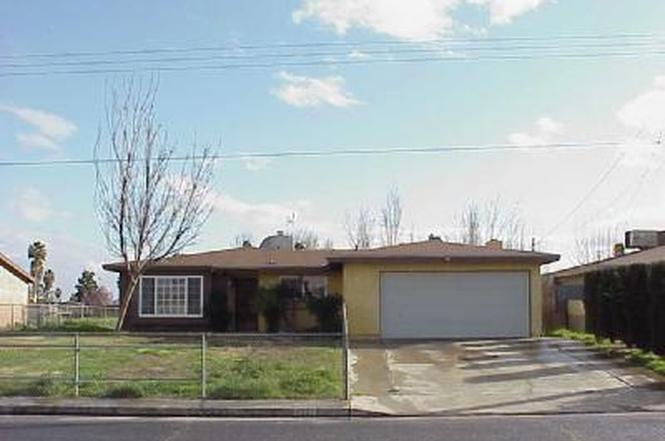
I want to click on 4 visible wires, so click(548, 35), click(544, 43), click(543, 53), click(519, 148).